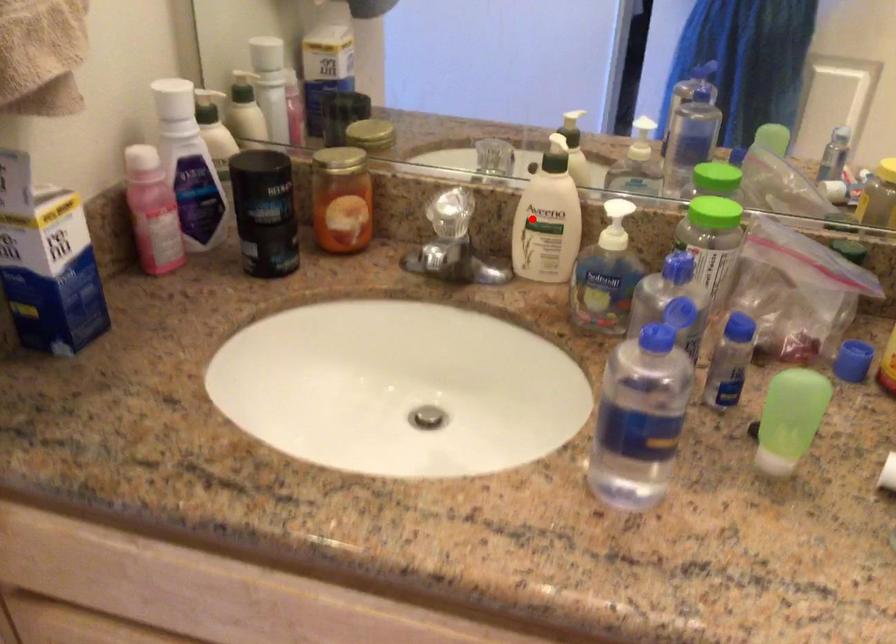
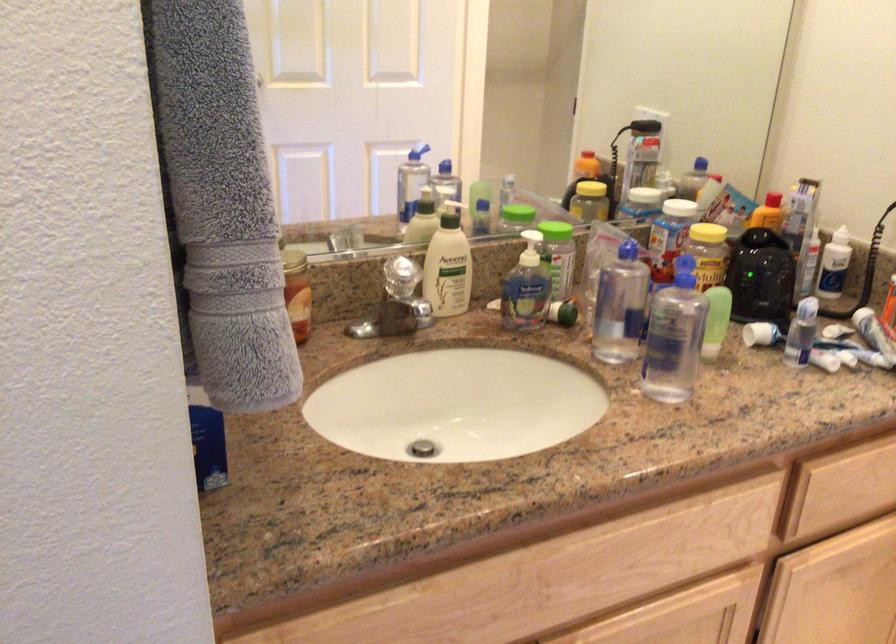
Find the pixel in the second image that matches the highlighted location in the first image.

(448, 265)